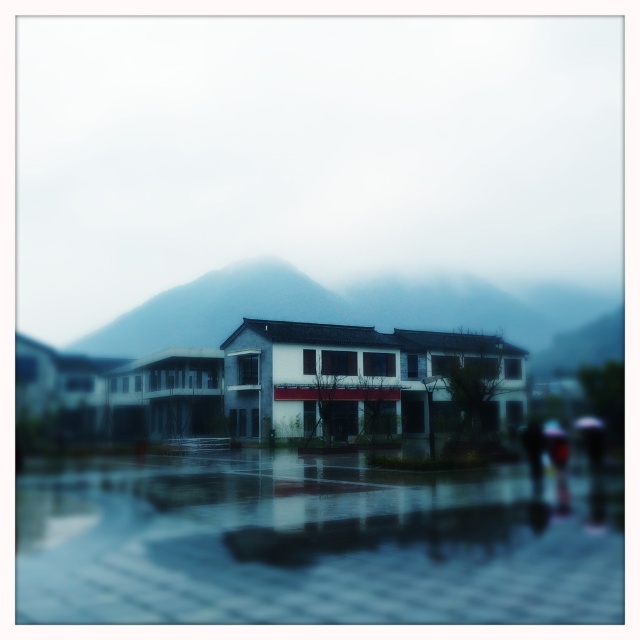
Question: Is the position of glossy reflective water at lower center less distant than that of matte gray mountain at center?

Choices:
 (A) no
 (B) yes

Answer: (B)

Question: Is glossy reflective water at lower center above matte gray mountain at center?

Choices:
 (A) no
 (B) yes

Answer: (A)

Question: Can you confirm if glossy reflective water at lower center is smaller than matte gray mountain at center?

Choices:
 (A) yes
 (B) no

Answer: (A)